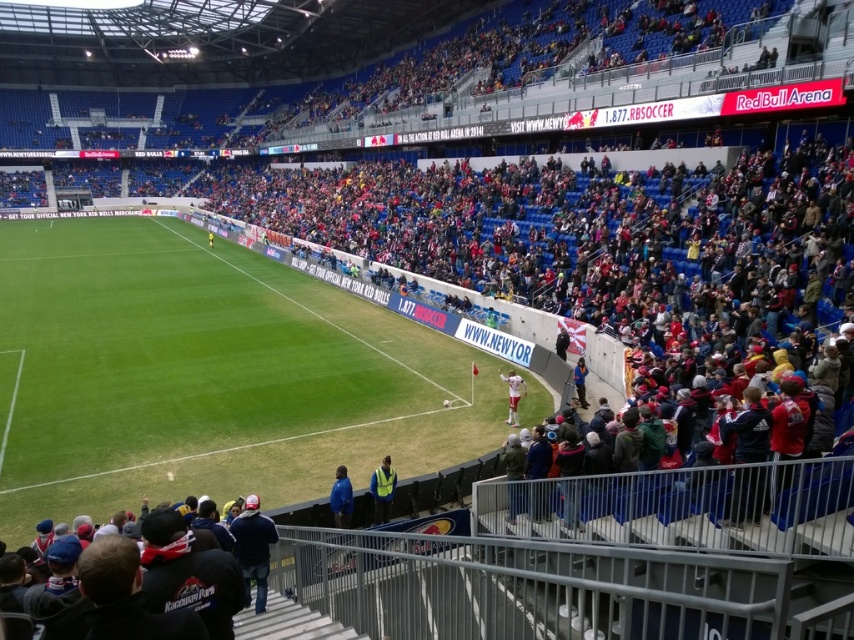
Is point (259, 573) more distant than point (522, 380)?

No, it is not.

Is dark blue jeans at lower center thinner than white fabric shirt at lower right?

In fact, dark blue jeans at lower center might be wider than white fabric shirt at lower right.

Locate an element on the screen. dark blue jeans at lower center is located at coordinates (253, 548).

Can you confirm if yellow reflective vest at center is wider than blue fabric jacket at lower center?

Yes.

You are a GUI agent. You are given a task and a screenshot of the screen. Output one action in this format:
    pyautogui.click(x=<x>, y=<y>)
    Task: Click on the yellow reflective vest at center
    This screenshot has height=640, width=854.
    Given the screenshot: What is the action you would take?
    pyautogui.click(x=382, y=490)

Is dark blue jacket at lower center wider than blue fabric jacket at right?

Yes, dark blue jacket at lower center is wider than blue fabric jacket at right.

Can you confirm if dark blue jacket at lower center is taller than blue fabric jacket at right?

No.

Is point (211, 545) less distant than point (578, 390)?

That is True.

This screenshot has width=854, height=640. I want to click on dark blue jacket at lower center, so click(192, 572).